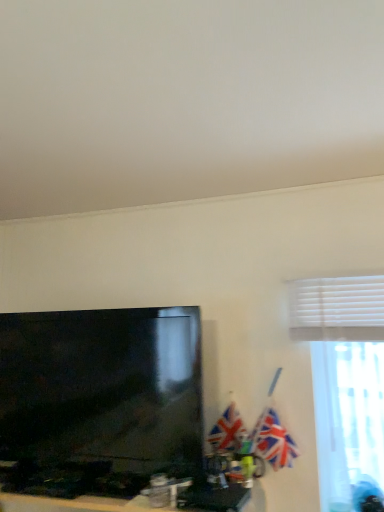
Question: Relative to matte black tv at lower left, is white blinds at upper right in front or behind?

Choices:
 (A) front
 (B) behind

Answer: (B)

Question: In terms of height, does white blinds at upper right look taller or shorter compared to matte black tv at lower left?

Choices:
 (A) tall
 (B) short

Answer: (A)

Question: Which object is the farthest from the union jack flag at right, the second flag from the left?

Choices:
 (A) textured fabric flag at center, arranged as the first flag when viewed from the left
 (B) white blinds at upper right
 (C) matte black tv at left
 (D) matte black tv at lower left
 (E) blue glossy flag pole at upper right

Answer: (C)

Question: Considering the real-world distances, which object is farthest from the matte black tv at left?

Choices:
 (A) textured fabric flag at center, arranged as the first flag when viewed from the left
 (B) union jack flag at right, marked as the first flag in a right-to-left arrangement
 (C) white blinds at upper right
 (D) blue glossy flag pole at upper right
 (E) matte black tv at lower left

Answer: (C)